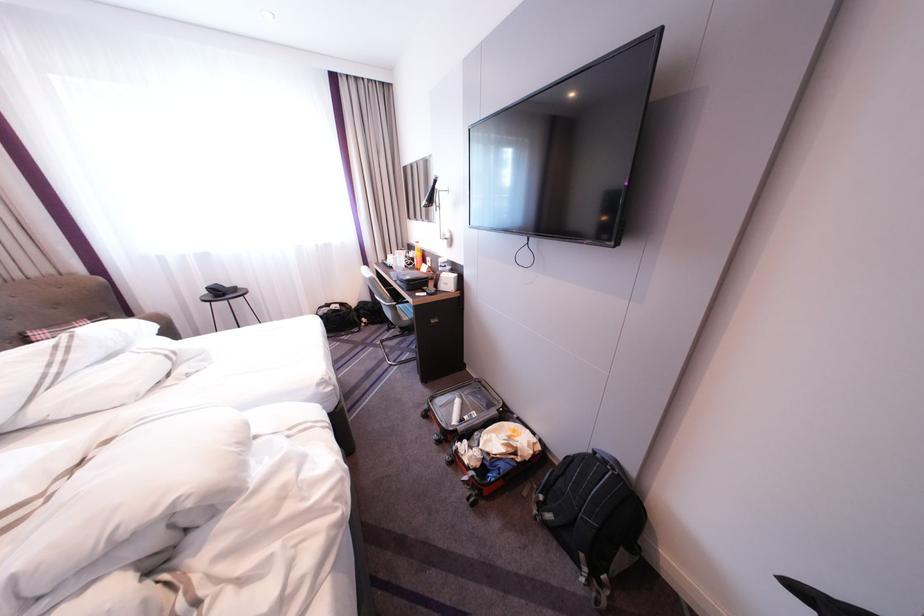
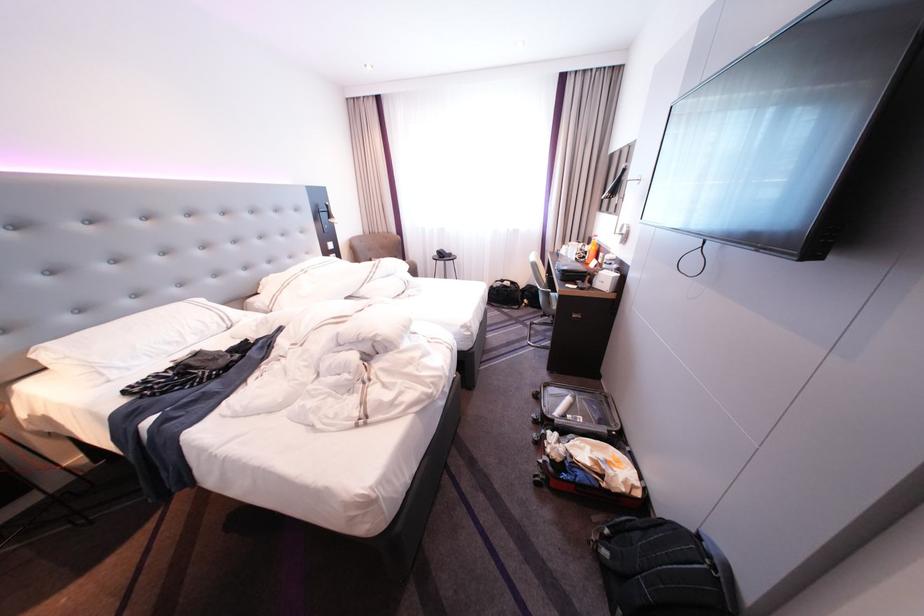
In the second image, find the point that corresponds to pixel 541 442 in the first image.

(639, 480)